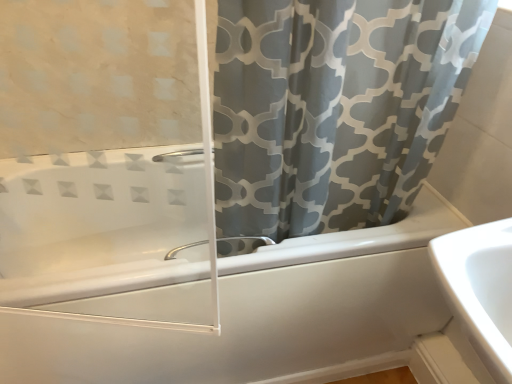
Question: Would you say satin nickel faucet at lower center is outside gray fabric curtain at upper right?

Choices:
 (A) no
 (B) yes

Answer: (A)

Question: Is the position of satin nickel faucet at lower center less distant than that of gray fabric curtain at upper right?

Choices:
 (A) no
 (B) yes

Answer: (A)

Question: Considering the relative positions of satin nickel faucet at lower center and gray fabric curtain at upper right in the image provided, is satin nickel faucet at lower center behind gray fabric curtain at upper right?

Choices:
 (A) yes
 (B) no

Answer: (A)

Question: Does satin nickel faucet at lower center have a lesser height compared to gray fabric curtain at upper right?

Choices:
 (A) no
 (B) yes

Answer: (B)

Question: Is satin nickel faucet at lower center positioned with its back to gray fabric curtain at upper right?

Choices:
 (A) yes
 (B) no

Answer: (B)

Question: Looking at their shapes, would you say gray fabric curtain at upper right is wider or thinner than satin nickel faucet at lower center?

Choices:
 (A) wide
 (B) thin

Answer: (A)

Question: In the image, is gray fabric curtain at upper right on the left side or the right side of satin nickel faucet at lower center?

Choices:
 (A) left
 (B) right

Answer: (B)

Question: From the image's perspective, is gray fabric curtain at upper right positioned above or below satin nickel faucet at lower center?

Choices:
 (A) above
 (B) below

Answer: (A)

Question: Relative to satin nickel faucet at lower center, is gray fabric curtain at upper right in front or behind?

Choices:
 (A) behind
 (B) front

Answer: (B)

Question: From a real-world perspective, is gray fabric curtain at upper right above or below white glossy bathtub at center?

Choices:
 (A) above
 (B) below

Answer: (A)

Question: Considering the positions of gray fabric curtain at upper right and white glossy bathtub at center in the image, is gray fabric curtain at upper right taller or shorter than white glossy bathtub at center?

Choices:
 (A) short
 (B) tall

Answer: (B)

Question: Would you say gray fabric curtain at upper right is inside or outside white glossy bathtub at center?

Choices:
 (A) inside
 (B) outside

Answer: (B)

Question: In terms of size, does gray fabric curtain at upper right appear bigger or smaller than white glossy bathtub at center?

Choices:
 (A) big
 (B) small

Answer: (B)

Question: From the image's perspective, relative to gray fabric curtain at upper right, is white glossy bathtub at center above or below?

Choices:
 (A) below
 (B) above

Answer: (A)

Question: Would you say white glossy bathtub at center is inside or outside gray fabric curtain at upper right?

Choices:
 (A) inside
 (B) outside

Answer: (B)